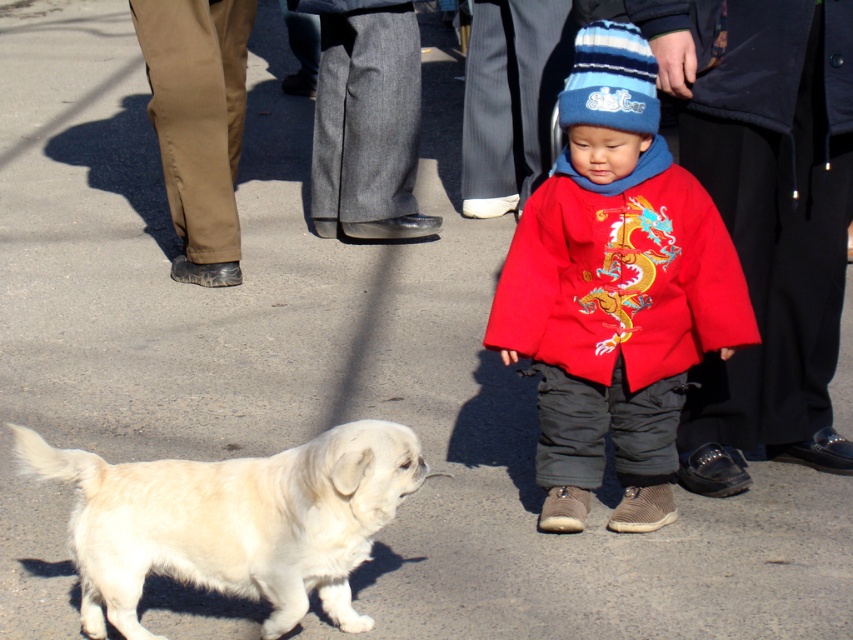
You are a photographer trying to capture a photo of the light beige fur at lower left and the blue knitted hat at center. Which object should you focus on first if you want to ensure both are in focus without adjusting the camera settings?

The light beige fur at lower left is taller than the blue knitted hat at center. Therefore, focusing on the light beige fur at lower left first will ensure both objects are in focus since it is the taller object.

You are a photographer trying to capture the scene with a camera placed at the same level as the child and dog. You want to focus on the point closer to you. Which point should you choose between point (612, 106) and point (263, 472)?

Point (612, 106) is further to the viewer than point (263, 472). Therefore, to focus on the point closer to you, you should choose point (263, 472).